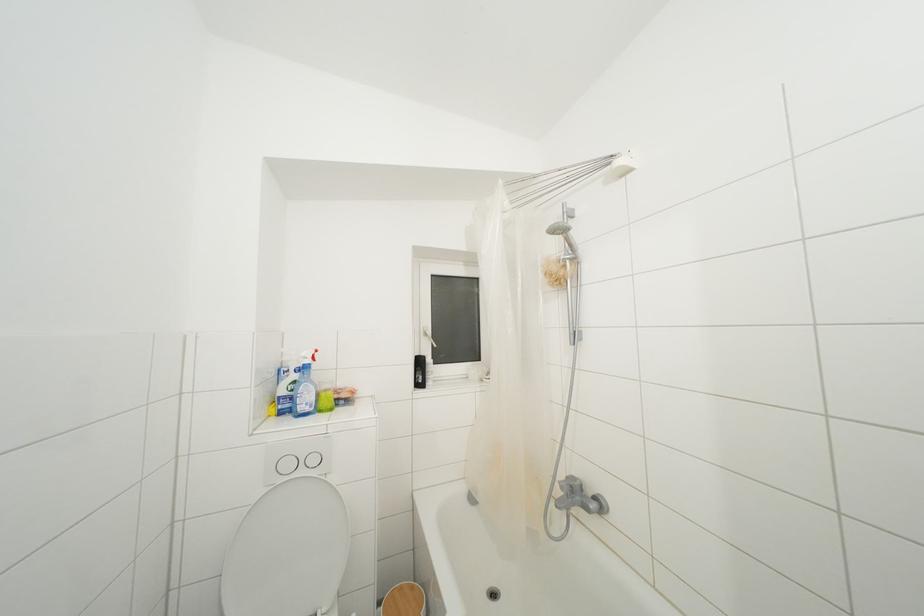
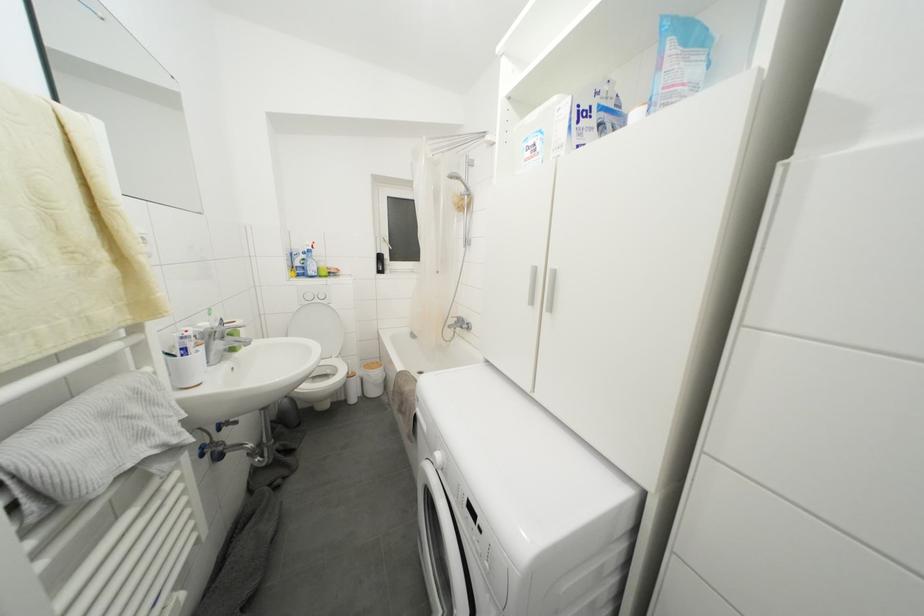
Which direction would the cameraman need to move to produce the second image?

The movement direction of the cameraman is right, backward.